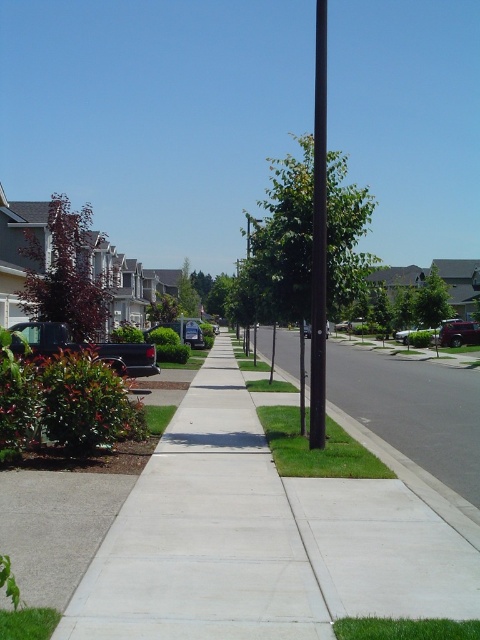
You are standing at the camera position in the suburban street scene. There is a point marked at coordinates point (291,605). Can you estimate how far this point is from your current position?

The distance of point (291,605) from camera is 4.14 meters, so the point is 4.14 meters away from your current position.

You are a delivery person trying to park your van near the black smooth pole at center and the dark gray matte truck at lower left. Which object takes up more space in the image?

The black smooth pole at center takes up more space in the image because it is bigger than the dark gray matte truck at lower left.